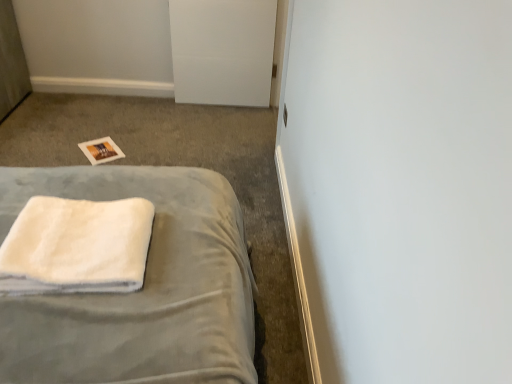
Question: From the image's perspective, would you say white soft towel at lower left is shown under white fluffy towel at lower left?

Choices:
 (A) yes
 (B) no

Answer: (B)

Question: Is white soft towel at lower left thinner than white fluffy towel at lower left?

Choices:
 (A) no
 (B) yes

Answer: (A)

Question: From a real-world perspective, is white soft towel at lower left under white fluffy towel at lower left?

Choices:
 (A) yes
 (B) no

Answer: (A)

Question: Is white soft towel at lower left closer to the viewer compared to white fluffy towel at lower left?

Choices:
 (A) yes
 (B) no

Answer: (B)

Question: Can you confirm if white soft towel at lower left is positioned to the left of white fluffy towel at lower left?

Choices:
 (A) no
 (B) yes

Answer: (B)

Question: In the image, is white matte door at upper center positioned in front of or behind white fluffy towel at lower left?

Choices:
 (A) front
 (B) behind

Answer: (B)

Question: From the image's perspective, is white matte door at upper center located above or below white fluffy towel at lower left?

Choices:
 (A) above
 (B) below

Answer: (A)

Question: Considering the positions of white matte door at upper center and white fluffy towel at lower left in the image, is white matte door at upper center taller or shorter than white fluffy towel at lower left?

Choices:
 (A) short
 (B) tall

Answer: (B)

Question: Would you say white matte door at upper center is inside or outside white fluffy towel at lower left?

Choices:
 (A) outside
 (B) inside

Answer: (A)

Question: In terms of size, does white fluffy towel at lower left appear bigger or smaller than white matte door at upper center?

Choices:
 (A) small
 (B) big

Answer: (A)

Question: From a real-world perspective, is white fluffy towel at lower left physically located above or below white matte door at upper center?

Choices:
 (A) above
 (B) below

Answer: (A)

Question: In the image, is white fluffy towel at lower left positioned in front of or behind white matte door at upper center?

Choices:
 (A) front
 (B) behind

Answer: (A)

Question: Do you think white fluffy towel at lower left is within white matte door at upper center, or outside of it?

Choices:
 (A) outside
 (B) inside

Answer: (A)

Question: In the image, is white matte door at upper center on the left side or the right side of white soft towel at lower left?

Choices:
 (A) right
 (B) left

Answer: (A)

Question: In terms of size, does white matte door at upper center appear bigger or smaller than white soft towel at lower left?

Choices:
 (A) big
 (B) small

Answer: (B)